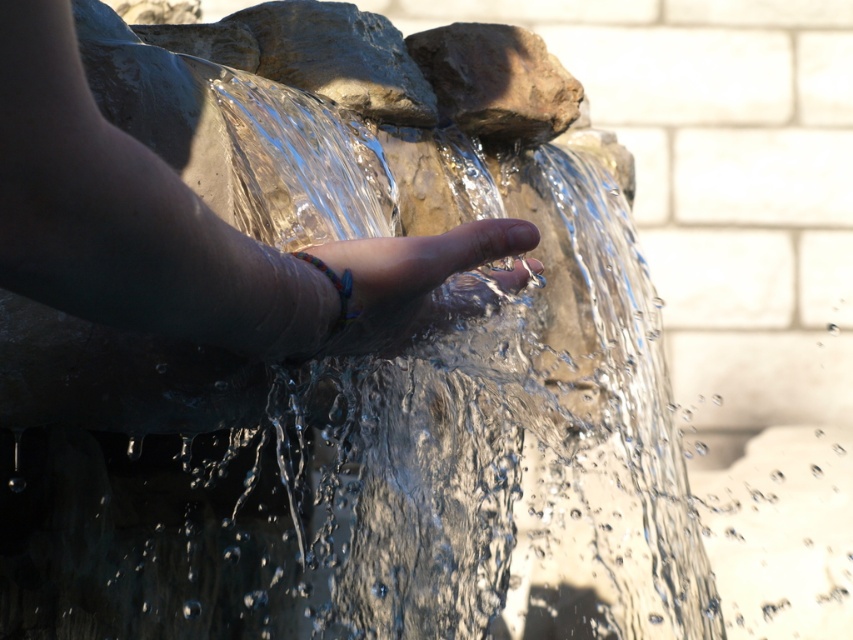
Can you confirm if smooth skin hand at center is positioned above rough stone at center?

No.

Is smooth skin hand at center positioned before rough stone at center?

Yes, smooth skin hand at center is closer to the viewer.

The width and height of the screenshot is (853, 640). What do you see at coordinates (181, 228) in the screenshot?
I see `smooth skin hand at center` at bounding box center [181, 228].

At what (x,y) coordinates should I click in order to perform the action: click on smooth skin hand at center. Please return your answer as a coordinate pair (x, y). Looking at the image, I should click on (181, 228).

Can you confirm if multicolored beaded bracelet at center is bigger than rough stone at center?

Actually, multicolored beaded bracelet at center might be smaller than rough stone at center.

Who is more distant from viewer, (317,330) or (569,90)?

The point (569,90) is behind.

Which is behind, point (453, 312) or point (479, 104)?

Point (479, 104)

Locate an element on the screen. The image size is (853, 640). multicolored beaded bracelet at center is located at coordinates (408, 284).

Who is positioned more to the left, smooth skin hand at center or multicolored beaded bracelet at center?

From the viewer's perspective, smooth skin hand at center appears more on the left side.

Looking at this image, does smooth skin hand at center have a larger size compared to multicolored beaded bracelet at center?

Yes.

This screenshot has width=853, height=640. Describe the element at coordinates (181, 228) in the screenshot. I see `smooth skin hand at center` at that location.

You are a GUI agent. You are given a task and a screenshot of the screen. Output one action in this format:
    pyautogui.click(x=<x>, y=<y>)
    Task: Click on the smooth skin hand at center
    This screenshot has height=640, width=853.
    Given the screenshot: What is the action you would take?
    181,228